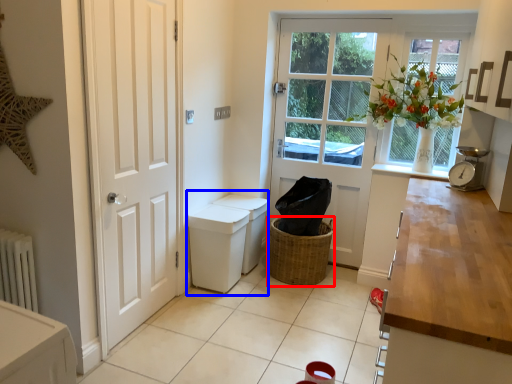
Question: Which object appears farthest to the camera in this image, basket (highlighted by a red box) or sink (highlighted by a blue box)?

Choices:
 (A) basket
 (B) sink

Answer: (A)